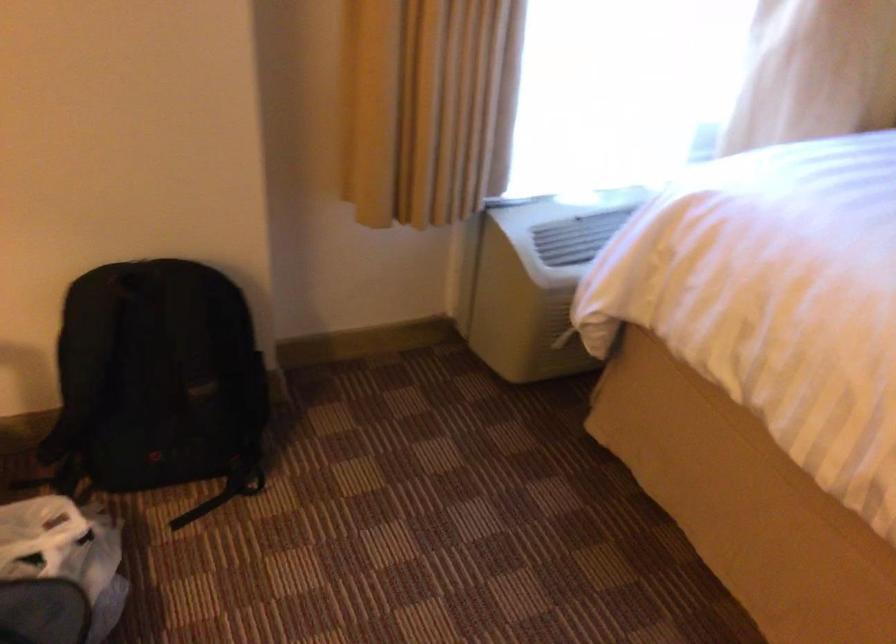
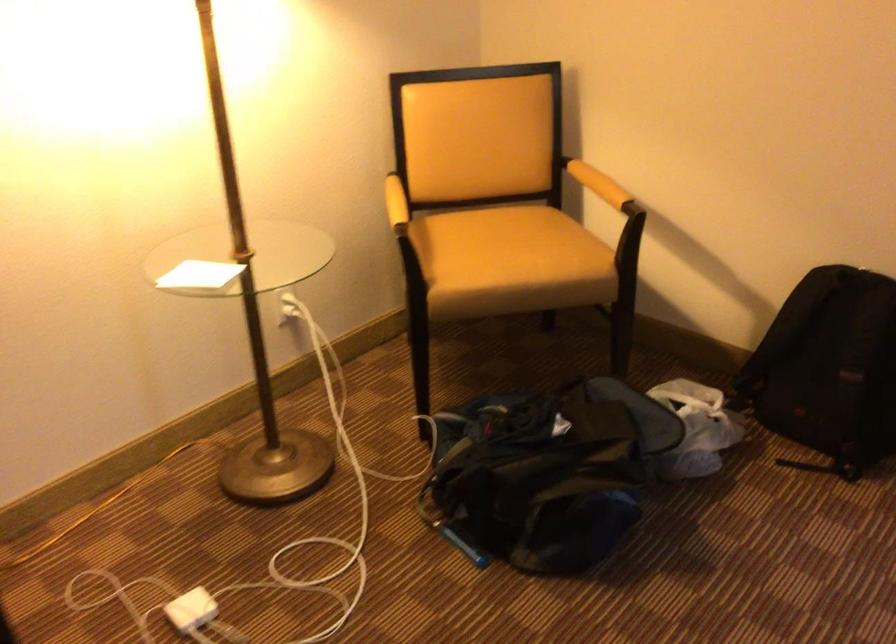
Locate, in the second image, the point that corresponds to the point at 177,395 in the first image.

(829, 368)